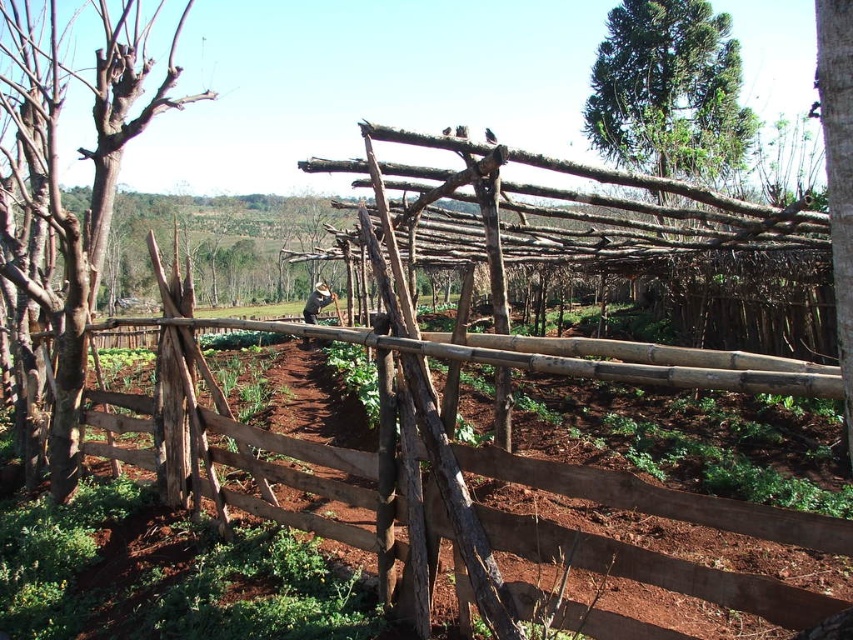
Question: Which point is closer to the camera?

Choices:
 (A) brown rough bark tree at right
 (B) brown wooden man at center

Answer: (A)

Question: Among these points, which one is nearest to the camera?

Choices:
 (A) (624, 13)
 (B) (851, 204)

Answer: (B)

Question: Is bare wood tree at left to the right of brown wooden man at center from the viewer's perspective?

Choices:
 (A) yes
 (B) no

Answer: (B)

Question: Based on their relative distances, which object is nearer to the green textured tree at upper right?

Choices:
 (A) brown wooden fence at center
 (B) brown wooden man at center
 (C) bare wood tree at left
 (D) brown rough bark tree at right

Answer: (B)

Question: Does brown wooden fence at center come behind green textured tree at upper right?

Choices:
 (A) no
 (B) yes

Answer: (A)

Question: Does bare wood tree at left appear over brown rough bark tree at right?

Choices:
 (A) yes
 (B) no

Answer: (A)